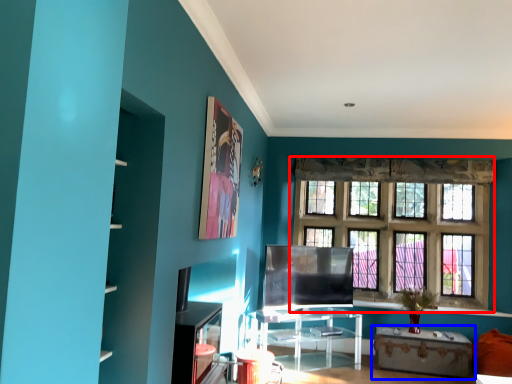
Question: Which of the following is the closest to the observer, window (highlighted by a red box) or table (highlighted by a blue box)?

Choices:
 (A) window
 (B) table

Answer: (B)